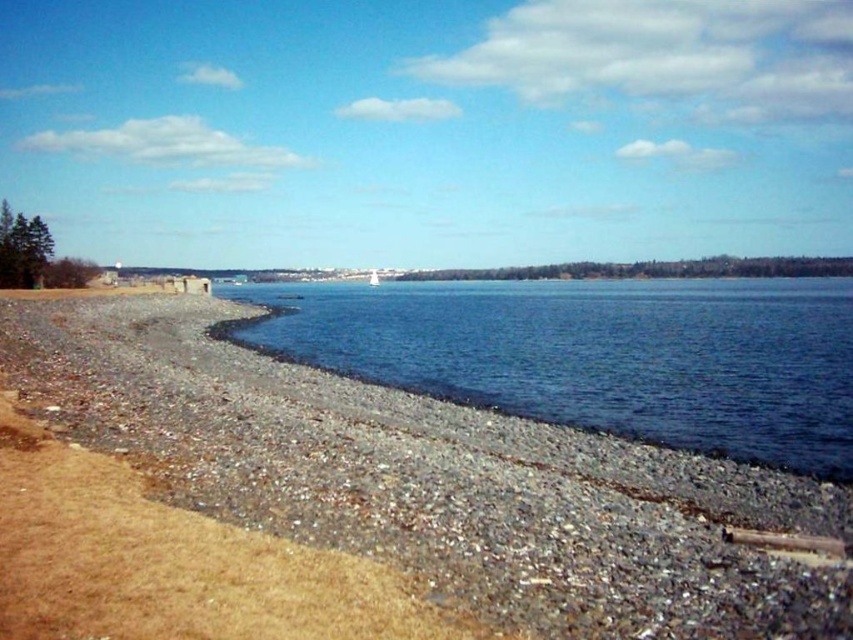
Between gravelly sand beach at lower left and blue water at center, which one has more height?

blue water at center is taller.

Based on the photo, can you confirm if gravelly sand beach at lower left is bigger than blue water at center?

No, gravelly sand beach at lower left is not bigger than blue water at center.

Describe the element at coordinates (432, 480) in the screenshot. I see `gravelly sand beach at lower left` at that location.

Identify the location of gravelly sand beach at lower left. The height and width of the screenshot is (640, 853). (432, 480).